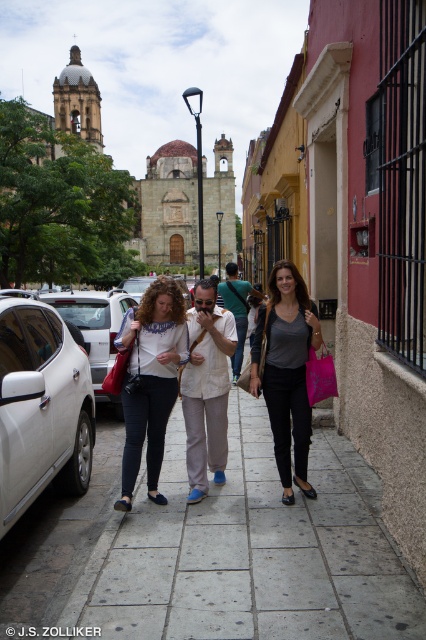
Which of these two, matte white blouse at center or matte gray shirt at center, stands shorter?

matte white blouse at center is shorter.

Between matte white blouse at center and matte gray shirt at center, which one appears on the left side from the viewer's perspective?

From the viewer's perspective, matte white blouse at center appears more on the left side.

You are a GUI agent. You are given a task and a screenshot of the screen. Output one action in this format:
    pyautogui.click(x=<x>, y=<y>)
    Task: Click on the matte white blouse at center
    
    Given the screenshot: What is the action you would take?
    pyautogui.click(x=150, y=380)

Looking at this image, between gray concrete pavement at center and matte gray shirt at center, which one has less height?

gray concrete pavement at center is shorter.

Does gray concrete pavement at center have a smaller size compared to matte gray shirt at center?

Actually, gray concrete pavement at center might be larger than matte gray shirt at center.

At what (x,y) coordinates should I click in order to perform the action: click on gray concrete pavement at center. Please return your answer as a coordinate pair (x, y). The image size is (426, 640). Looking at the image, I should click on (213, 550).

Is gray concrete pavement at center to the left of white glossy car at lower left from the viewer's perspective?

No, gray concrete pavement at center is not to the left of white glossy car at lower left.

Which is more to the right, gray concrete pavement at center or white glossy car at lower left?

gray concrete pavement at center

Between point (80, 586) and point (8, 365), which one is positioned in front?

Point (80, 586) is in front.

Image resolution: width=426 pixels, height=640 pixels. Identify the location of gray concrete pavement at center. (213, 550).